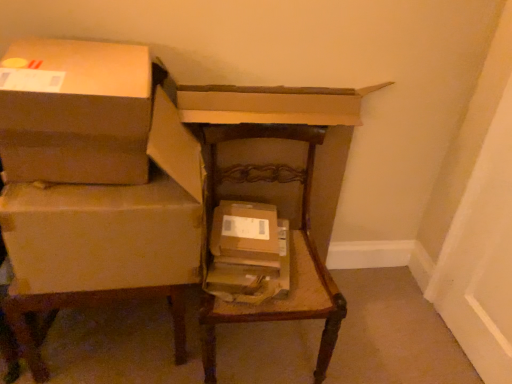
Question: From a real-world perspective, is brown cardboard box at left, positioned as the second box in right-to-left order, located higher than brown cardboard box at center, which appears as the third box when viewed from the left?

Choices:
 (A) no
 (B) yes

Answer: (B)

Question: Does brown cardboard box at left, positioned as the second box in right-to-left order, lie behind brown cardboard box at center, which ranks as the 1th box in right-to-left order?

Choices:
 (A) yes
 (B) no

Answer: (B)

Question: Is brown cardboard box at left, positioned as the second box in right-to-left order, taller than brown cardboard box at center, which ranks as the 1th box in right-to-left order?

Choices:
 (A) yes
 (B) no

Answer: (A)

Question: Is brown cardboard box at left, positioned as the second box in left-to-right order, positioned with its back to brown cardboard box at center, which appears as the third box when viewed from the left?

Choices:
 (A) yes
 (B) no

Answer: (B)

Question: Is brown cardboard box at left, positioned as the second box in right-to-left order, next to brown cardboard box at center, which appears as the third box when viewed from the left, and touching it?

Choices:
 (A) yes
 (B) no

Answer: (B)

Question: From the image's perspective, relative to brown cardboard box at upper left, which is the 1th box in left-to-right order, is brown cardboard box at center, which ranks as the 1th box in right-to-left order, above or below?

Choices:
 (A) above
 (B) below

Answer: (B)

Question: Considering the positions of brown cardboard box at center, which ranks as the 1th box in right-to-left order, and brown cardboard box at upper left, arranged as the third box when viewed from the right, in the image, is brown cardboard box at center, which ranks as the 1th box in right-to-left order, wider or thinner than brown cardboard box at upper left, arranged as the third box when viewed from the right,?

Choices:
 (A) wide
 (B) thin

Answer: (B)

Question: Based on their positions, is brown cardboard box at center, which ranks as the 1th box in right-to-left order, located to the left or right of brown cardboard box at upper left, which is the 1th box in left-to-right order?

Choices:
 (A) left
 (B) right

Answer: (B)

Question: Is brown cardboard box at center, which appears as the third box when viewed from the left, taller or shorter than brown cardboard box at upper left, arranged as the third box when viewed from the right?

Choices:
 (A) tall
 (B) short

Answer: (B)

Question: Looking at their shapes, would you say brown cardboard box at upper left, arranged as the third box when viewed from the right, is wider or thinner than brown cardboard boxes at left, placed as the 1th furniture when sorted from left to right?

Choices:
 (A) thin
 (B) wide

Answer: (A)

Question: Is brown cardboard box at upper left, arranged as the third box when viewed from the right, to the left or to the right of brown cardboard boxes at left, placed as the 2th furniture when sorted from right to left, in the image?

Choices:
 (A) right
 (B) left

Answer: (A)

Question: Is brown cardboard box at upper left, which is the 1th box in left-to-right order, taller or shorter than brown cardboard boxes at left, placed as the 1th furniture when sorted from left to right?

Choices:
 (A) short
 (B) tall

Answer: (A)

Question: Is brown cardboard box at upper left, arranged as the third box when viewed from the right, in front of or behind brown cardboard boxes at left, placed as the 1th furniture when sorted from left to right, in the image?

Choices:
 (A) behind
 (B) front

Answer: (A)

Question: Is brown cardboard box at left, positioned as the second box in right-to-left order, taller or shorter than wooden chair at center, the first furniture when ordered from right to left?

Choices:
 (A) tall
 (B) short

Answer: (B)

Question: From the image's perspective, is brown cardboard box at left, positioned as the second box in right-to-left order, positioned above or below wooden chair at center, the first furniture when ordered from right to left?

Choices:
 (A) above
 (B) below

Answer: (A)